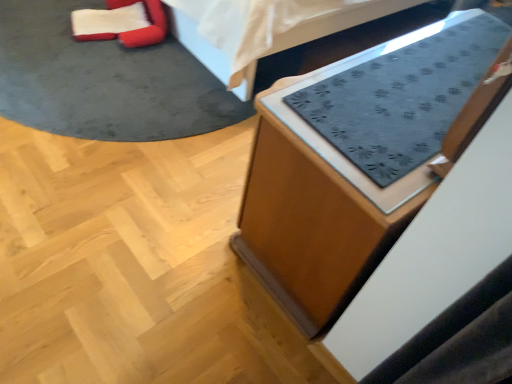
This screenshot has width=512, height=384. I want to click on wooden cabinet at lower right, which is the second furniture from top to bottom, so click(331, 200).

Looking at this image, in order to face velvet red bean bag chair at upper left, should I rotate leftwards or rightwards?

Turn left approximately 18.598 degrees to face it.

Identify the location of dark gray fabric mat at upper center, the first furniture positioned from the top. The width and height of the screenshot is (512, 384). (338, 38).

How many degrees apart are the facing directions of dark gray fabric mat at upper center, the first furniture positioned from the top, and velvet red bean bag chair at upper left?

20.3 degrees separate the facing orientations of dark gray fabric mat at upper center, the first furniture positioned from the top, and velvet red bean bag chair at upper left.

Is dark gray fabric mat at upper center, which appears as the second furniture when ordered from the bottom, next to velvet red bean bag chair at upper left and touching it?

No, dark gray fabric mat at upper center, which appears as the second furniture when ordered from the bottom, is not beside velvet red bean bag chair at upper left.

Would you say dark gray fabric mat at upper center, which appears as the second furniture when ordered from the bottom, is outside velvet red bean bag chair at upper left?

Absolutely, dark gray fabric mat at upper center, which appears as the second furniture when ordered from the bottom, is external to velvet red bean bag chair at upper left.

Does dark gray fabric mat at upper center, the first furniture positioned from the top, have a smaller size compared to velvet red bean bag chair at upper left?

No.

From the image's perspective, is velvet red bean bag chair at upper left over wooden cabinet at lower right, which ranks as the 1th furniture in bottom-to-top order?

Yes.

Is point (160, 40) closer to camera compared to point (286, 290)?

No, (160, 40) is further to viewer.

Measure the distance from velvet red bean bag chair at upper left to wooden cabinet at lower right, which is the second furniture from top to bottom.

velvet red bean bag chair at upper left is 1.51 meters away from wooden cabinet at lower right, which is the second furniture from top to bottom.

From a real-world perspective, does velvet red bean bag chair at upper left sit lower than wooden cabinet at lower right, which is the second furniture from top to bottom?

Correct, in the physical world, velvet red bean bag chair at upper left is lower than wooden cabinet at lower right, which is the second furniture from top to bottom.

Locate an element on the screen. The image size is (512, 384). furniture below the wooden cabinet at lower right, which ranks as the 1th furniture in bottom-to-top order (from a real-world perspective) is located at coordinates (338, 38).

Considering the sizes of objects wooden cabinet at lower right, which is the second furniture from top to bottom, and dark gray fabric mat at upper center, which appears as the second furniture when ordered from the bottom, in the image provided, who is shorter, wooden cabinet at lower right, which is the second furniture from top to bottom, or dark gray fabric mat at upper center, which appears as the second furniture when ordered from the bottom,?

With less height is dark gray fabric mat at upper center, which appears as the second furniture when ordered from the bottom.

Visually, is wooden cabinet at lower right, which is the second furniture from top to bottom, positioned to the left or to the right of dark gray fabric mat at upper center, which appears as the second furniture when ordered from the bottom?

In the image, wooden cabinet at lower right, which is the second furniture from top to bottom, appears on the right side of dark gray fabric mat at upper center, which appears as the second furniture when ordered from the bottom.

Who is smaller, wooden cabinet at lower right, which ranks as the 1th furniture in bottom-to-top order, or dark gray fabric mat at upper center, the first furniture positioned from the top?

With smaller size is wooden cabinet at lower right, which ranks as the 1th furniture in bottom-to-top order.

Is velvet red bean bag chair at upper left not inside dark gray fabric mat at upper center, the first furniture positioned from the top?

velvet red bean bag chair at upper left lies outside dark gray fabric mat at upper center, the first furniture positioned from the top,'s area.

From the picture: Is velvet red bean bag chair at upper left at the left side of dark gray fabric mat at upper center, the first furniture positioned from the top?

Yes, velvet red bean bag chair at upper left is to the left of dark gray fabric mat at upper center, the first furniture positioned from the top.

This screenshot has height=384, width=512. What are the coordinates of `bean bag chair located below the dark gray fabric mat at upper center, the first furniture positioned from the top (from the image's perspective)` in the screenshot? It's located at (122, 23).

Between point (93, 40) and point (259, 83), which one is positioned behind?

The point (259, 83) is farther from the camera.

Is dark gray fabric mat at upper center, the first furniture positioned from the top, positioned in front of wooden cabinet at lower right, which is the second furniture from top to bottom?

No, dark gray fabric mat at upper center, the first furniture positioned from the top, is further to the viewer.

How different are the orientations of dark gray fabric mat at upper center, the first furniture positioned from the top, and wooden cabinet at lower right, which is the second furniture from top to bottom, in degrees?

They differ by 91.2 degrees in their facing directions.

Based on the photo, considering the relative positions of dark gray fabric mat at upper center, the first furniture positioned from the top, and wooden cabinet at lower right, which ranks as the 1th furniture in bottom-to-top order, in the image provided, is dark gray fabric mat at upper center, the first furniture positioned from the top, to the left or to the right of wooden cabinet at lower right, which ranks as the 1th furniture in bottom-to-top order,?

dark gray fabric mat at upper center, the first furniture positioned from the top, is to the left of wooden cabinet at lower right, which ranks as the 1th furniture in bottom-to-top order.

Which of these two, dark gray fabric mat at upper center, the first furniture positioned from the top, or wooden cabinet at lower right, which ranks as the 1th furniture in bottom-to-top order, stands shorter?

dark gray fabric mat at upper center, the first furniture positioned from the top.

Who is bigger, wooden cabinet at lower right, which ranks as the 1th furniture in bottom-to-top order, or velvet red bean bag chair at upper left?

Bigger between the two is wooden cabinet at lower right, which ranks as the 1th furniture in bottom-to-top order.

From the image's perspective, which is below, wooden cabinet at lower right, which ranks as the 1th furniture in bottom-to-top order, or velvet red bean bag chair at upper left?

wooden cabinet at lower right, which ranks as the 1th furniture in bottom-to-top order, is shown below in the image.

Is wooden cabinet at lower right, which is the second furniture from top to bottom, turned away from velvet red bean bag chair at upper left?

No, wooden cabinet at lower right, which is the second furniture from top to bottom, is not facing away from velvet red bean bag chair at upper left.

The width and height of the screenshot is (512, 384). Find the location of `furniture lying below the velvet red bean bag chair at upper left (from the image's perspective)`. furniture lying below the velvet red bean bag chair at upper left (from the image's perspective) is located at coordinates (331, 200).

Where is `bean bag chair behind the dark gray fabric mat at upper center, which appears as the second furniture when ordered from the bottom`? bean bag chair behind the dark gray fabric mat at upper center, which appears as the second furniture when ordered from the bottom is located at coordinates (122, 23).

Find the location of `bean bag chair that is above the wooden cabinet at lower right, which ranks as the 1th furniture in bottom-to-top order (from the image's perspective)`. bean bag chair that is above the wooden cabinet at lower right, which ranks as the 1th furniture in bottom-to-top order (from the image's perspective) is located at coordinates (122, 23).

Looking at the image, which one is located closer to dark gray fabric mat at upper center, the first furniture positioned from the top, velvet red bean bag chair at upper left or wooden cabinet at lower right, which ranks as the 1th furniture in bottom-to-top order?

velvet red bean bag chair at upper left is positioned closer to the anchor dark gray fabric mat at upper center, the first furniture positioned from the top.

When comparing their distances from velvet red bean bag chair at upper left, does dark gray fabric mat at upper center, which appears as the second furniture when ordered from the bottom, or wooden cabinet at lower right, which is the second furniture from top to bottom, seem further?

wooden cabinet at lower right, which is the second furniture from top to bottom.

In the scene shown: When comparing their distances from wooden cabinet at lower right, which ranks as the 1th furniture in bottom-to-top order, does dark gray fabric mat at upper center, the first furniture positioned from the top, or velvet red bean bag chair at upper left seem closer?

Among the two, dark gray fabric mat at upper center, the first furniture positioned from the top, is located nearer to wooden cabinet at lower right, which ranks as the 1th furniture in bottom-to-top order.

Which object lies nearer to the anchor point wooden cabinet at lower right, which ranks as the 1th furniture in bottom-to-top order, velvet red bean bag chair at upper left or dark gray fabric mat at upper center, which appears as the second furniture when ordered from the bottom?

dark gray fabric mat at upper center, which appears as the second furniture when ordered from the bottom, is closer to wooden cabinet at lower right, which ranks as the 1th furniture in bottom-to-top order.

Estimate the real-world distances between objects in this image. Which object is closer to velvet red bean bag chair at upper left, wooden cabinet at lower right, which is the second furniture from top to bottom, or dark gray fabric mat at upper center, the first furniture positioned from the top?

Among the two, dark gray fabric mat at upper center, the first furniture positioned from the top, is located nearer to velvet red bean bag chair at upper left.

Looking at the image, which one is located closer to dark gray fabric mat at upper center, the first furniture positioned from the top, wooden cabinet at lower right, which ranks as the 1th furniture in bottom-to-top order, or velvet red bean bag chair at upper left?

velvet red bean bag chair at upper left.

Identify the location of furniture between velvet red bean bag chair at upper left and wooden cabinet at lower right, which is the second furniture from top to bottom, in the horizontal direction. This screenshot has width=512, height=384. coord(338,38).